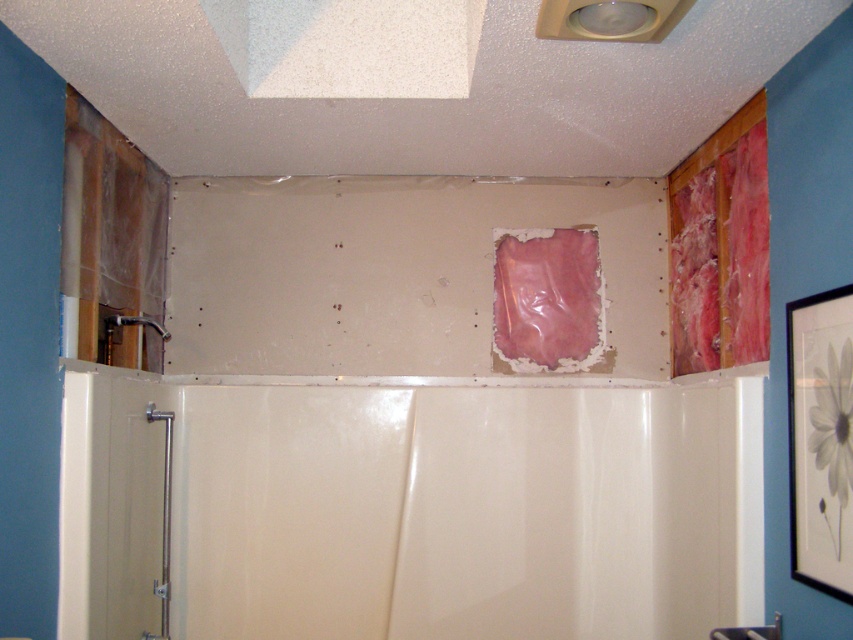
You are a contractor assessing the bathroom renovation. You see the white glossy bathtub at center and the pink paper at center. Which object is positioned lower in the scene?

The white glossy bathtub at center is positioned below the pink paper at center, so it is lower in the scene.

You are a contractor assessing the bathroom renovation. You see the white glossy bathtub at center and the matte silver faucet at left. Which object is higher in height?

The white glossy bathtub at center is taller than the matte silver faucet at left.